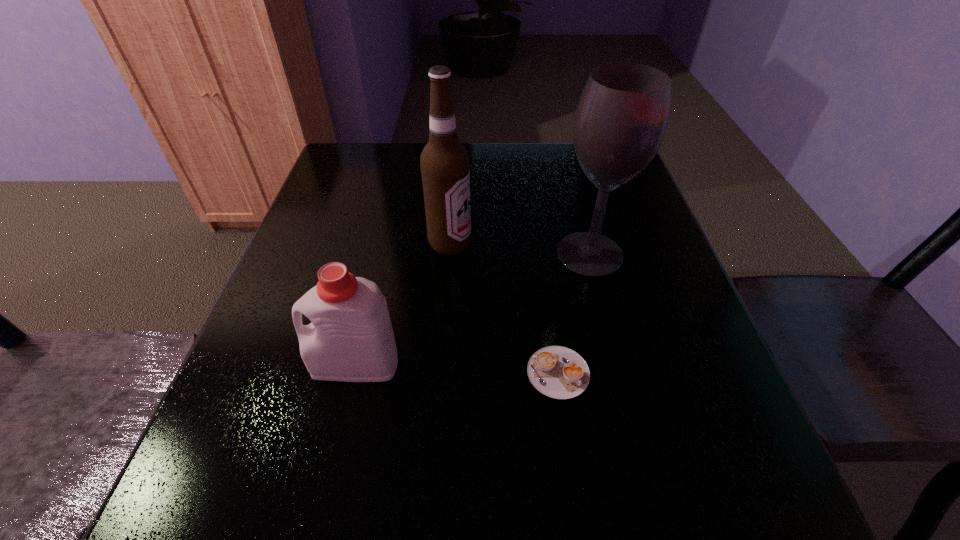
You are a GUI agent. You are given a task and a screenshot of the screen. Output one action in this format:
    pyautogui.click(x=<x>, y=<y>)
    Task: Click on the vacant point that satisfies the following two spatial constraints: 1. on the handle side of the leftmost object; 2. on the left side of the shortest object
    The height and width of the screenshot is (540, 960).
    Given the screenshot: What is the action you would take?
    pyautogui.click(x=353, y=373)

Find the location of a particular element. This screenshot has height=540, width=960. blank area in the image that satisfies the following two spatial constraints: 1. on the front side of the right alcohol; 2. on the handle side of the third tallest object is located at coordinates (619, 364).

You are a GUI agent. You are given a task and a screenshot of the screen. Output one action in this format:
    pyautogui.click(x=<x>, y=<y>)
    Task: Click on the free space that satisfies the following two spatial constraints: 1. on the label of the shortest object; 2. on the right side of the left alcohol
    
    Given the screenshot: What is the action you would take?
    pyautogui.click(x=441, y=373)

Locate an element on the screen. vacant space that satisfies the following two spatial constraints: 1. on the handle side of the detergent; 2. on the left side of the shortest object is located at coordinates (353, 373).

Where is `free space that satisfies the following two spatial constraints: 1. on the label of the right alcohol; 2. on the left side of the left alcohol`? The image size is (960, 540). free space that satisfies the following two spatial constraints: 1. on the label of the right alcohol; 2. on the left side of the left alcohol is located at coordinates (449, 254).

The image size is (960, 540). Find the location of `free space that satisfies the following two spatial constraints: 1. on the back side of the shortest object; 2. on the label of the third object from right to left`. free space that satisfies the following two spatial constraints: 1. on the back side of the shortest object; 2. on the label of the third object from right to left is located at coordinates (540, 244).

The height and width of the screenshot is (540, 960). I want to click on vacant space that satisfies the following two spatial constraints: 1. on the label of the right alcohol; 2. on the left side of the second object from left to right, so click(x=449, y=254).

Where is `free space that satisfies the following two spatial constraints: 1. on the label of the left alcohol; 2. on the back side of the right alcohol`? free space that satisfies the following two spatial constraints: 1. on the label of the left alcohol; 2. on the back side of the right alcohol is located at coordinates (449, 254).